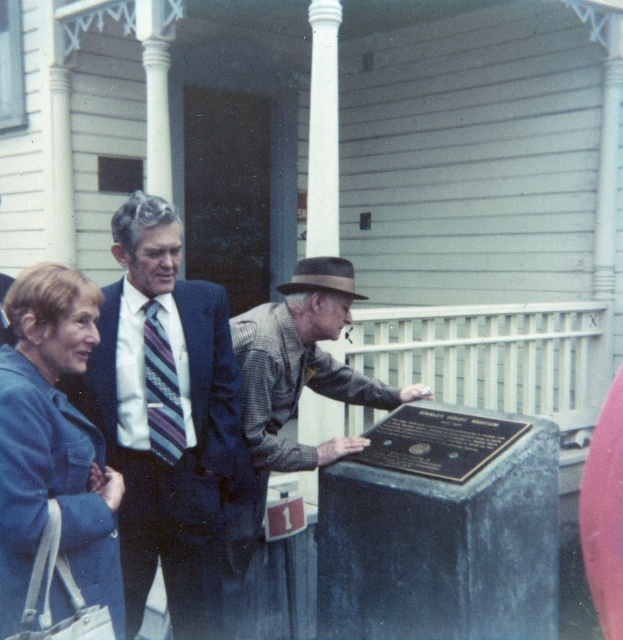
Question: Which point is farther to the camera?

Choices:
 (A) (153, 259)
 (B) (477, 467)
 (C) (249, 314)

Answer: (C)

Question: Among these objects, which one is nearest to the camera?

Choices:
 (A) bronze plaque at center
 (B) denim jacket at lower left
 (C) plaid shirt at center
 (D) striped tie at center

Answer: (B)

Question: Considering the real-world distances, which object is closest to the plaid shirt at center?

Choices:
 (A) bronze plaque at center
 (B) denim jacket at lower left

Answer: (A)

Question: Can you confirm if striped tie at center is positioned to the left of plaid shirt at center?

Choices:
 (A) no
 (B) yes

Answer: (B)

Question: Does denim jacket at lower left appear under bronze plaque at center?

Choices:
 (A) no
 (B) yes

Answer: (A)

Question: Does denim jacket at lower left have a greater width compared to plaid shirt at center?

Choices:
 (A) no
 (B) yes

Answer: (A)